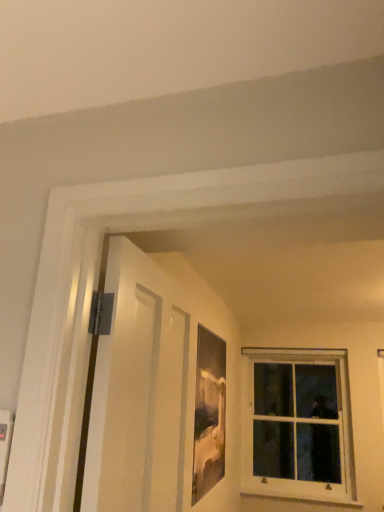
Question: From the image's perspective, would you say matte wooden picture frame at center is shown under white wood window at upper right?

Choices:
 (A) yes
 (B) no

Answer: (B)

Question: Is there a large distance between matte wooden picture frame at center and white wood window at upper right?

Choices:
 (A) no
 (B) yes

Answer: (B)

Question: Does matte wooden picture frame at center have a larger size compared to white wood window at upper right?

Choices:
 (A) no
 (B) yes

Answer: (A)

Question: Is matte wooden picture frame at center wider than white wood window at upper right?

Choices:
 (A) no
 (B) yes

Answer: (A)

Question: Considering the relative sizes of matte wooden picture frame at center and white wood window at upper right in the image provided, is matte wooden picture frame at center taller than white wood window at upper right?

Choices:
 (A) no
 (B) yes

Answer: (A)

Question: Considering the positions of white matte door at left and white wood window at upper right in the image, is white matte door at left taller or shorter than white wood window at upper right?

Choices:
 (A) short
 (B) tall

Answer: (A)

Question: From a real-world perspective, is white matte door at left positioned above or below white wood window at upper right?

Choices:
 (A) below
 (B) above

Answer: (B)

Question: Looking at the image, does white matte door at left seem bigger or smaller compared to white wood window at upper right?

Choices:
 (A) big
 (B) small

Answer: (B)

Question: Is white matte door at left spatially inside white wood window at upper right, or outside of it?

Choices:
 (A) outside
 (B) inside

Answer: (A)

Question: Is white wood window at upper right to the left or to the right of matte wooden picture frame at center in the image?

Choices:
 (A) right
 (B) left

Answer: (A)

Question: From the image's perspective, is white wood window at upper right positioned above or below matte wooden picture frame at center?

Choices:
 (A) above
 (B) below

Answer: (B)

Question: Is white wood window at upper right wider or thinner than matte wooden picture frame at center?

Choices:
 (A) wide
 (B) thin

Answer: (A)

Question: Is point (331, 452) closer or farther from the camera than point (216, 381)?

Choices:
 (A) farther
 (B) closer

Answer: (A)

Question: From a real-world perspective, is matte wooden picture frame at center physically located above or below white matte door at left?

Choices:
 (A) above
 (B) below

Answer: (B)

Question: Which is correct: matte wooden picture frame at center is inside white matte door at left, or outside of it?

Choices:
 (A) outside
 (B) inside

Answer: (A)